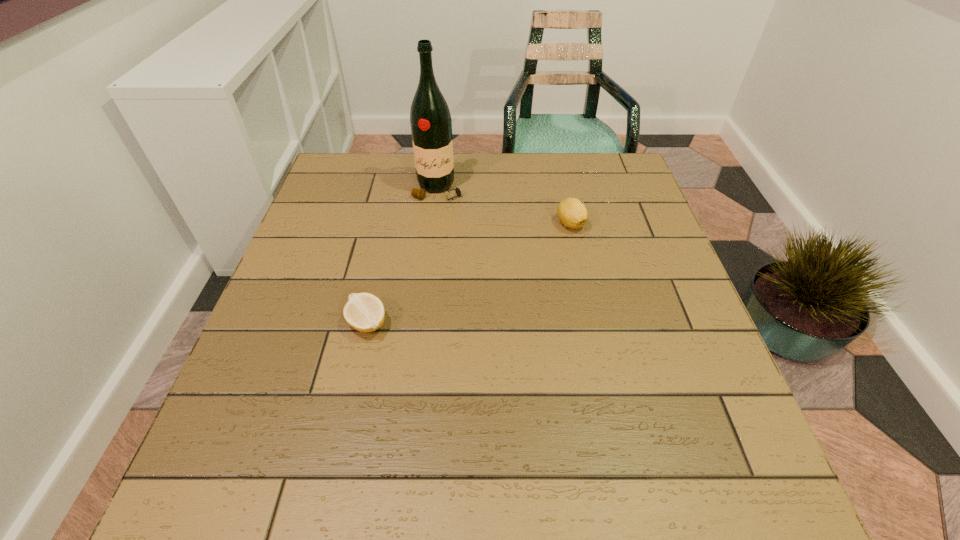
Locate an element on the screen. The height and width of the screenshot is (540, 960). vacant region at the far edge of the desktop is located at coordinates (438, 197).

In the image, there is a desktop. What are the coordinates of `vacant space at the near edge` in the screenshot? It's located at (322, 499).

I want to click on free space at the left edge, so click(x=355, y=200).

Locate an element on the screen. The image size is (960, 540). vacant area at the right edge of the desktop is located at coordinates (623, 303).

Find the location of a particular element. This screenshot has width=960, height=540. vacant space at the far left corner of the desktop is located at coordinates (380, 178).

In the image, there is a desktop. Identify the location of free region at the far right corner. (629, 195).

The height and width of the screenshot is (540, 960). In order to click on free spot between the leftmost object and the farthest object in this screenshot , I will do `click(402, 256)`.

Where is `vacant space in between the wine bottle and the leftmost object`? This screenshot has width=960, height=540. vacant space in between the wine bottle and the leftmost object is located at coordinates (402, 256).

Image resolution: width=960 pixels, height=540 pixels. What are the coordinates of `free space between the nearest object and the farthest object` in the screenshot? It's located at (402, 256).

Find the location of a particular element. Image resolution: width=960 pixels, height=540 pixels. empty space that is in between the nearer lemon and the second object from right to left is located at coordinates (402, 256).